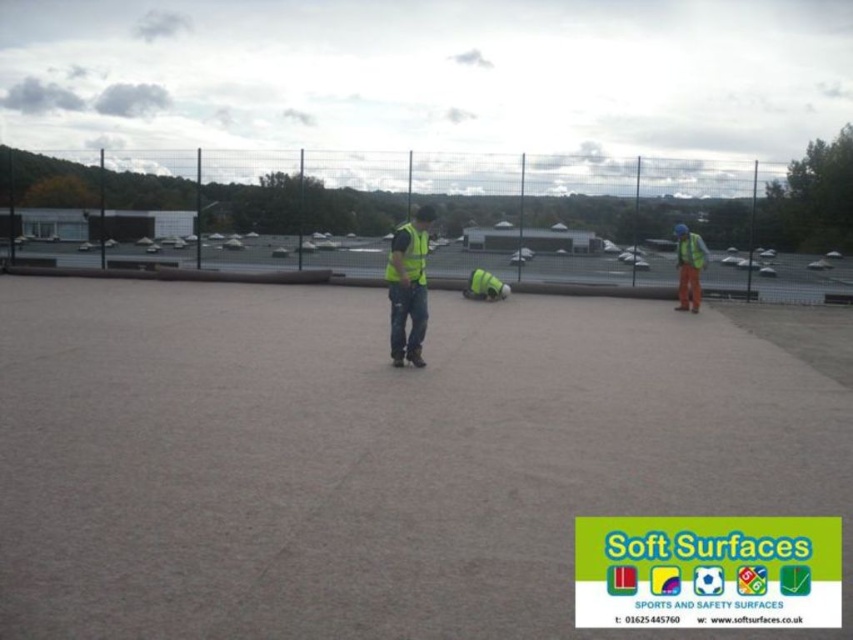
Between gray concrete parking lot at center and yellow reflective safety vest at right, which one is positioned higher?

yellow reflective safety vest at right is above.

Does point (540, 262) lie behind point (677, 256)?

Yes, it is.

This screenshot has width=853, height=640. Describe the element at coordinates (556, 272) in the screenshot. I see `gray concrete parking lot at center` at that location.

Find the location of `gray concrete parking lot at center`. gray concrete parking lot at center is located at coordinates (556, 272).

Does gray concrete parking lot at center have a greater width compared to high visibility fabric safety vest at right?

Correct, the width of gray concrete parking lot at center exceeds that of high visibility fabric safety vest at right.

Who is taller, gray concrete parking lot at center or high visibility fabric safety vest at right?

high visibility fabric safety vest at right is taller.

This screenshot has height=640, width=853. Identify the location of gray concrete parking lot at center. (556, 272).

Between point (285, 266) and point (392, 352), which one is positioned in front?

Point (392, 352) is more forward.

The image size is (853, 640). I want to click on gray concrete parking lot at center, so click(x=556, y=272).